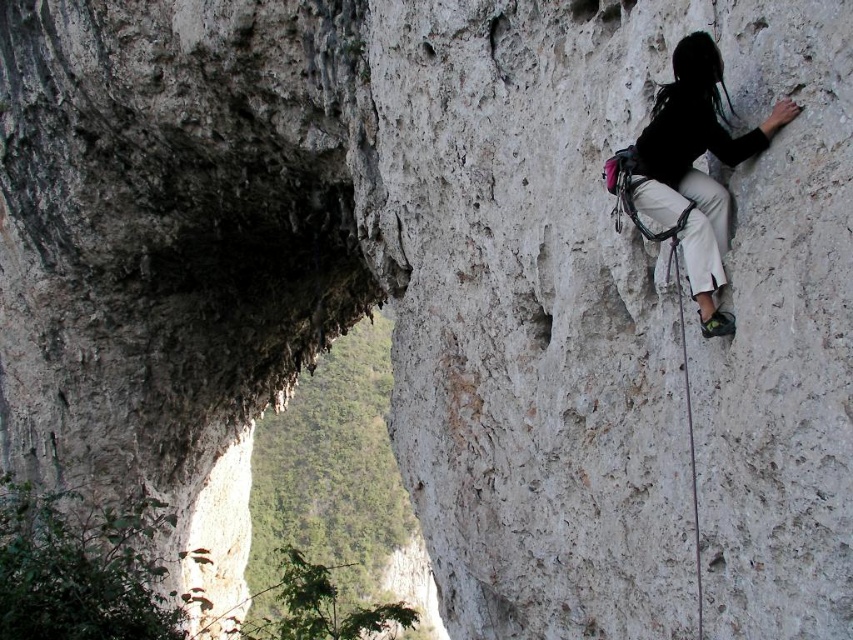
Who is positioned more to the left, black fabric harness at right or white nylon rope at right?

Positioned to the left is black fabric harness at right.

Is black fabric harness at right closer to camera compared to white nylon rope at right?

Yes, it is in front of white nylon rope at right.

Is point (709, 266) positioned after point (677, 304)?

That is False.

The image size is (853, 640). Identify the location of black fabric harness at right. (693, 168).